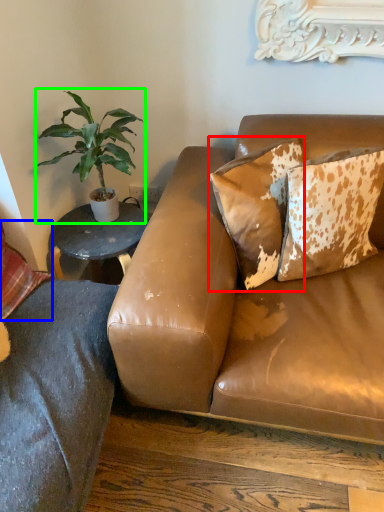
Question: Estimate the real-world distances between objects in this image. Which object is farther from pillow (highlighted by a red box), pillow (highlighted by a blue box) or houseplant (highlighted by a green box)?

Choices:
 (A) pillow
 (B) houseplant

Answer: (A)